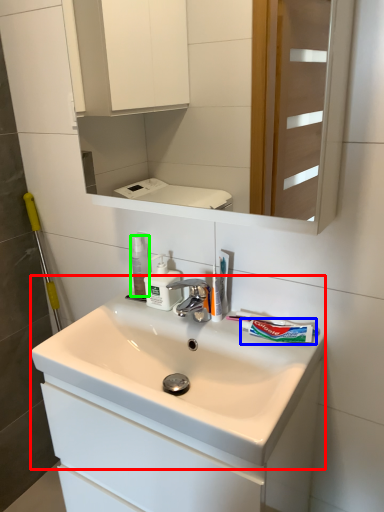
Question: Which is farther away from sink (highlighted by a red box)? toothpaste (highlighted by a blue box) or mouthwash (highlighted by a green box)?

Choices:
 (A) toothpaste
 (B) mouthwash

Answer: (B)